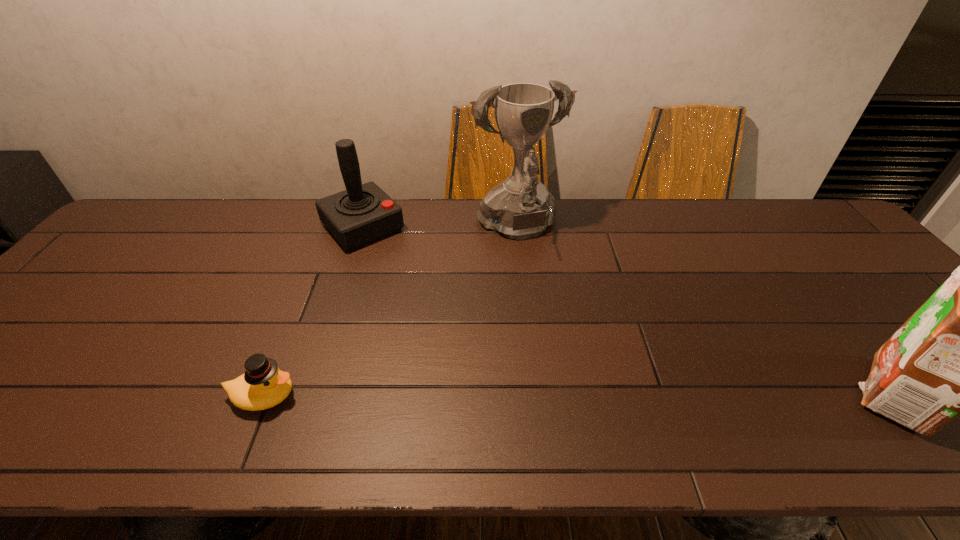
What are the coordinates of `vacant space on the desktop that is between the duck and the carton and is positioned on the side with emblem of the tallest object` in the screenshot? It's located at (610, 395).

Identify the location of vacant space on the desktop that is between the shortest object and the rightmost object and is positioned on the base of the joystick. The height and width of the screenshot is (540, 960). (518, 395).